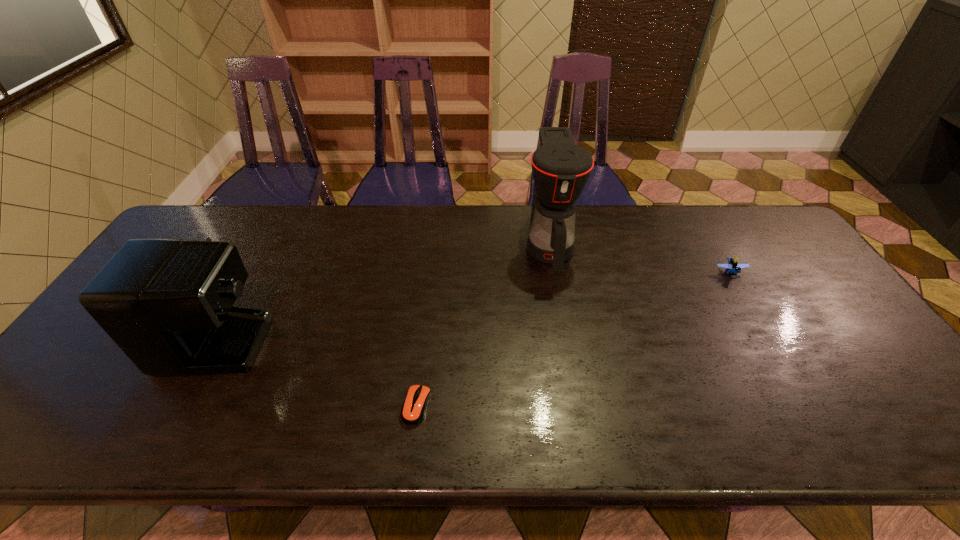
The width and height of the screenshot is (960, 540). What are the coordinates of `free area in between the shortest object and the shorter coffee maker` in the screenshot? It's located at (324, 354).

You are a GUI agent. You are given a task and a screenshot of the screen. Output one action in this format:
    pyautogui.click(x=<x>, y=<y>)
    Task: Click on the vacant area that lies between the nearest object and the second shortest object
    
    Given the screenshot: What is the action you would take?
    pyautogui.click(x=573, y=339)

Locate an element on the screen. free space between the shorter coffee maker and the tallest object is located at coordinates (390, 274).

Locate an element on the screen. blank region between the taller coffee maker and the leftmost object is located at coordinates (390, 274).

At what (x,y) coordinates should I click in order to perform the action: click on vacant area that lies between the taller coffee maker and the rightmost object. Please return your answer as a coordinate pair (x, y). Looking at the image, I should click on (639, 259).

Where is `free point between the nearest object and the taller coffee maker`? free point between the nearest object and the taller coffee maker is located at coordinates (483, 326).

At what (x,y) coordinates should I click in order to perform the action: click on free point between the left coffee maker and the third object from right to left. Please return your answer as a coordinate pair (x, y). The height and width of the screenshot is (540, 960). Looking at the image, I should click on (324, 354).

This screenshot has width=960, height=540. I want to click on vacant area that lies between the tallest object and the rightmost object, so click(x=639, y=259).

Locate an element on the screen. vacant area between the third object from right to left and the third tallest object is located at coordinates (573, 339).

Identify which object is located as the third nearest to the left coffee maker. Please provide its 2D coordinates. Your answer should be formatted as a tuple, i.e. [(x, y)], where the tuple contains the x and y coordinates of a point satisfying the conditions above.

[(733, 266)]